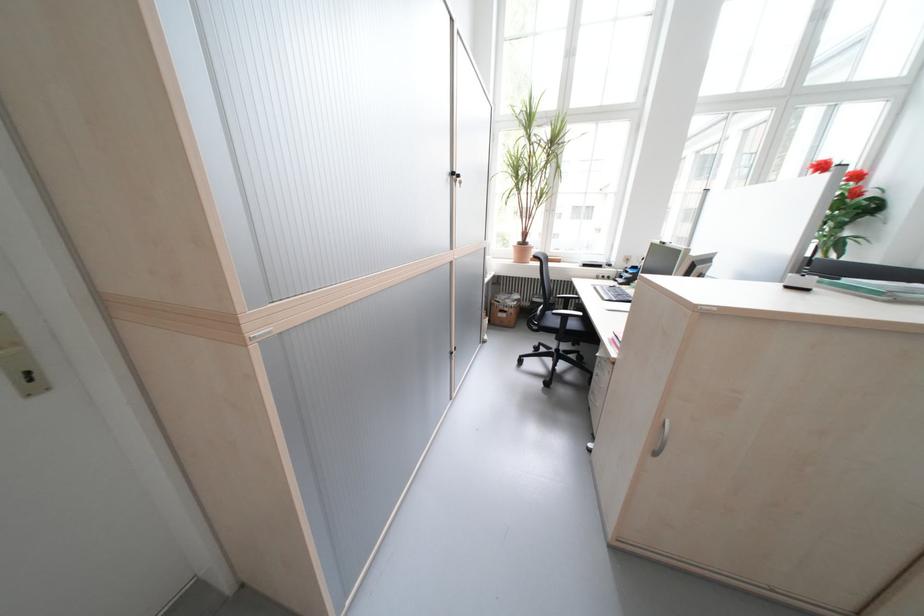
I want to click on silver cabinet handle, so click(662, 439).